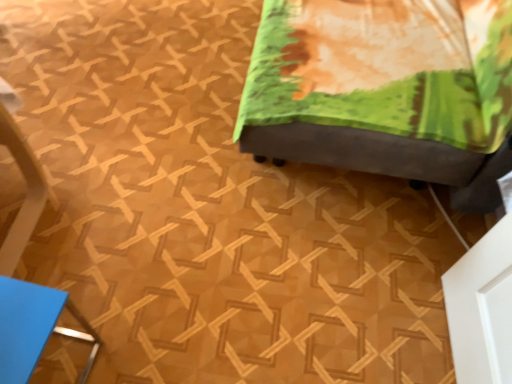
Where is `vacant area that is in front of velvet green ottoman at center, placed as the 2th furniture when sorted from bottom to top`? Image resolution: width=512 pixels, height=384 pixels. vacant area that is in front of velvet green ottoman at center, placed as the 2th furniture when sorted from bottom to top is located at coordinates (259, 271).